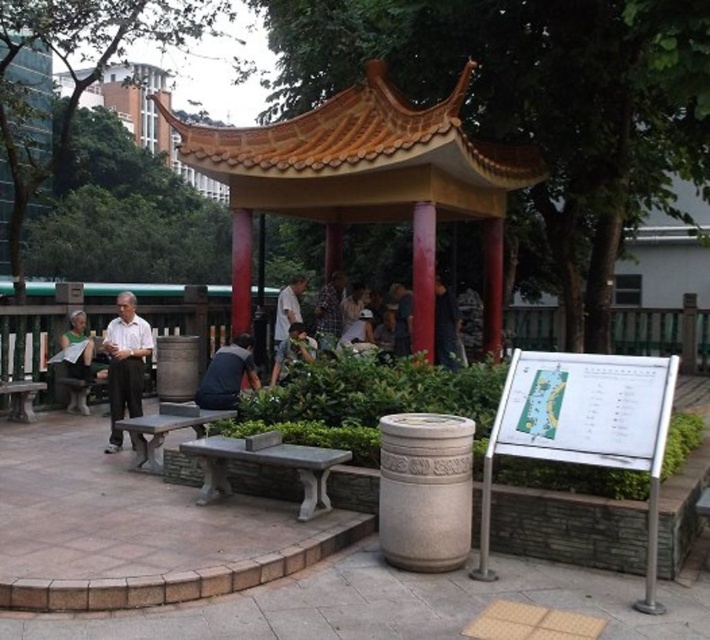
Question: Which point is farther to the camera?

Choices:
 (A) (245, 236)
 (B) (109, 355)

Answer: (A)

Question: Is stone bench at center to the right of dark green textured shirt at center from the viewer's perspective?

Choices:
 (A) no
 (B) yes

Answer: (A)

Question: Does stone bench at center lie in front of red polished wood pillar at center?

Choices:
 (A) yes
 (B) no

Answer: (A)

Question: Which point is farther to the camera?

Choices:
 (A) smooth red pillar at center
 (B) stone bench at center
 (C) white matte shirt at center

Answer: (A)

Question: Which point is farther from the camera taking this photo?

Choices:
 (A) (240, 301)
 (B) (327, 316)
 (C) (38, 381)
 (D) (324, 456)

Answer: (B)

Question: Can you confirm if white matte shirt at center is positioned below smooth gray stone bench at lower left?

Choices:
 (A) yes
 (B) no

Answer: (B)